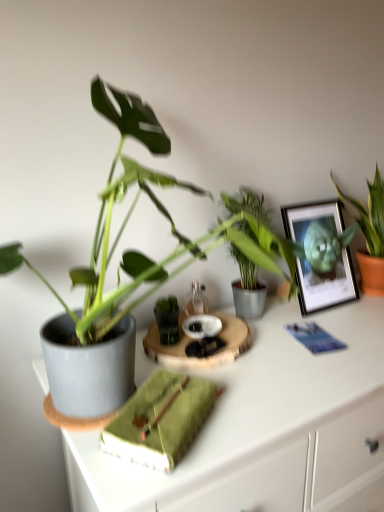
Identify the location of unoccupied area in front of metallic silver picture frame at upper right. (341, 329).